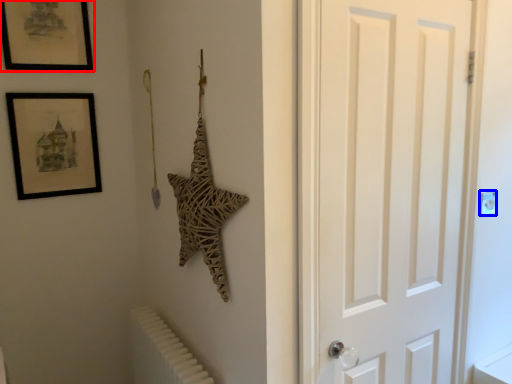
Question: Which object is closer to the camera taking this photo, picture frame (highlighted by a red box) or light switch (highlighted by a blue box)?

Choices:
 (A) picture frame
 (B) light switch

Answer: (B)